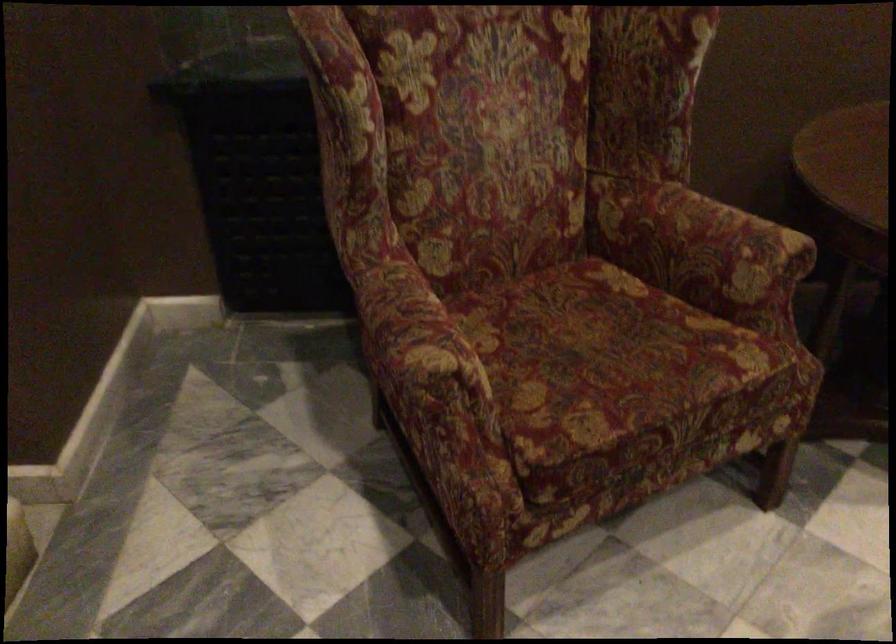
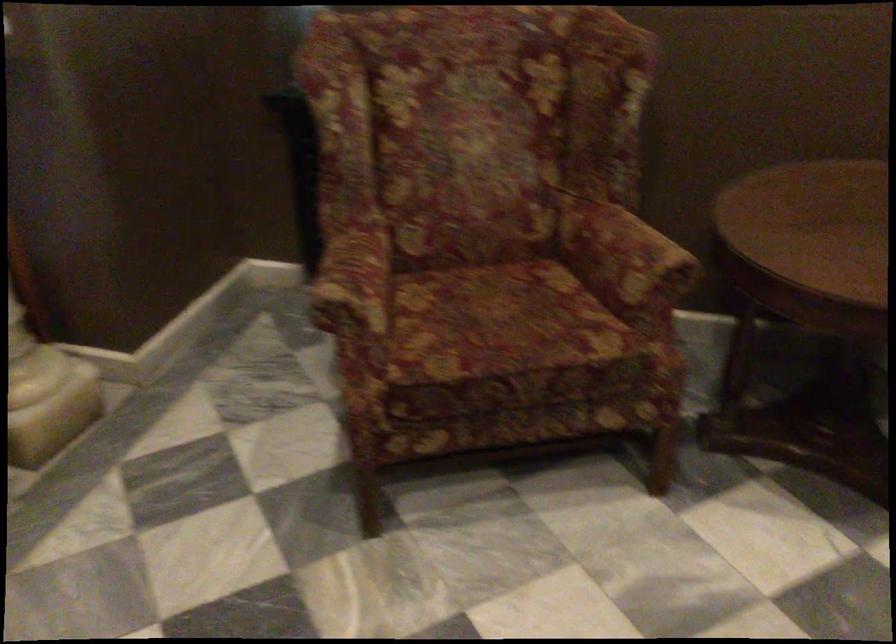
The point at (x=452, y=348) is marked in the first image. Where is the corresponding point in the second image?

(355, 286)